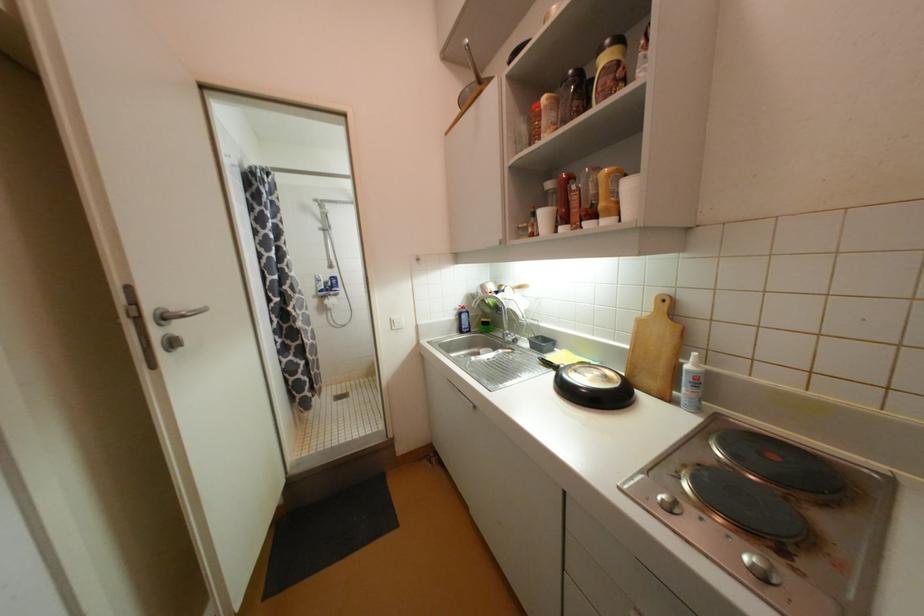
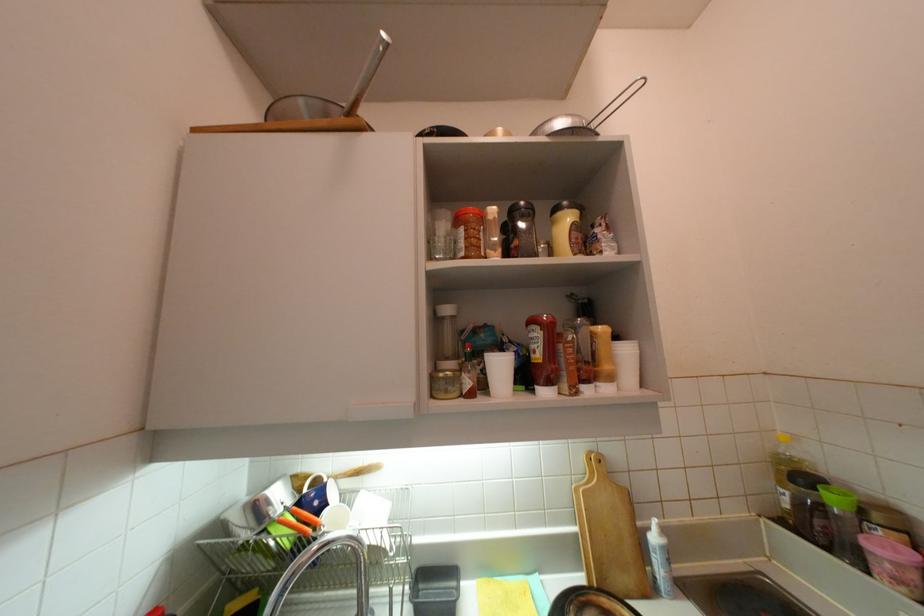
In the second image, find the point that corresponds to pixel 693 368 in the first image.

(660, 540)